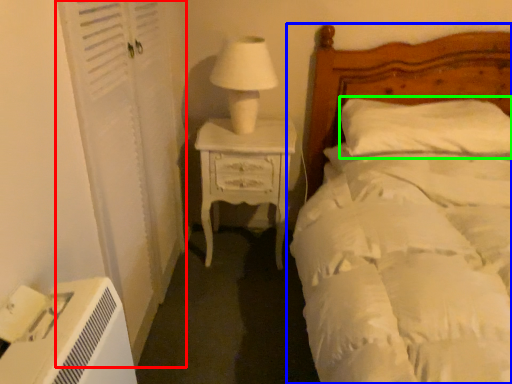
Question: Which is farther away from screen door (highlighted by a red box)? bed (highlighted by a blue box) or pillow (highlighted by a green box)?

Choices:
 (A) bed
 (B) pillow

Answer: (B)